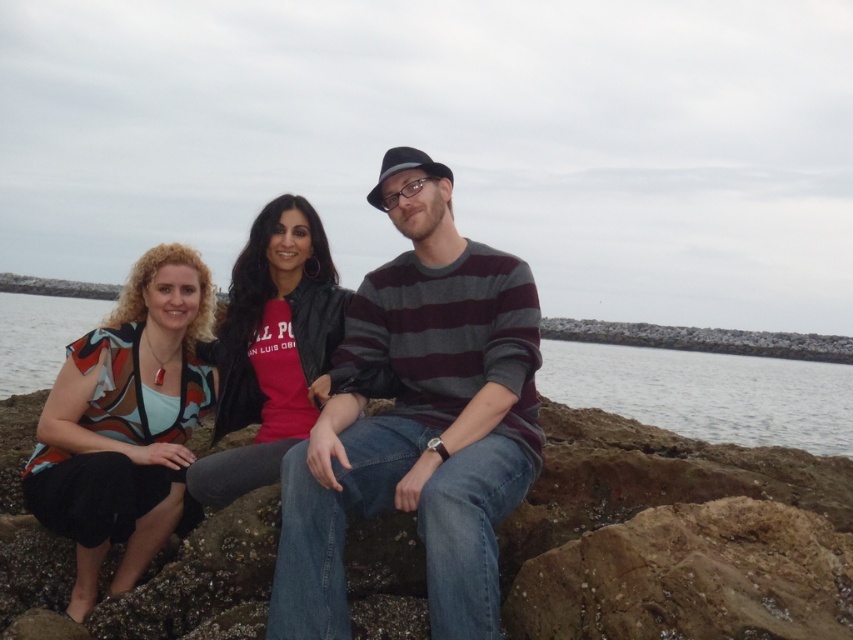
Question: Which object appears farthest from the camera in this image?

Choices:
 (A) striped sweater at center
 (B) clear water at center

Answer: (B)

Question: Does clear water at center have a smaller size compared to matte black jacket at center?

Choices:
 (A) yes
 (B) no

Answer: (B)

Question: Is striped sweater at center wider than matte multicolored blouse at left?

Choices:
 (A) yes
 (B) no

Answer: (A)

Question: Can you confirm if striped sweater at center is bigger than matte multicolored blouse at left?

Choices:
 (A) yes
 (B) no

Answer: (A)

Question: Which is farther from the striped sweater at center?

Choices:
 (A) matte multicolored blouse at left
 (B) matte black jacket at center

Answer: (A)

Question: Based on their relative distances, which object is farther from the striped sweater at center?

Choices:
 (A) matte multicolored blouse at left
 (B) matte black jacket at center

Answer: (A)